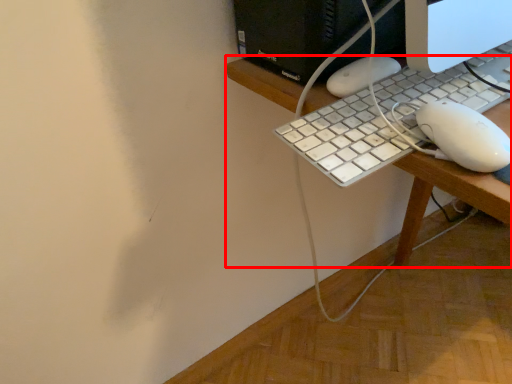
Question: From the image's perspective, considering the relative positions of desk (annotated by the red box) and computer keyboard in the image provided, where is desk (annotated by the red box) located with respect to the staircase?

Choices:
 (A) below
 (B) above

Answer: (A)